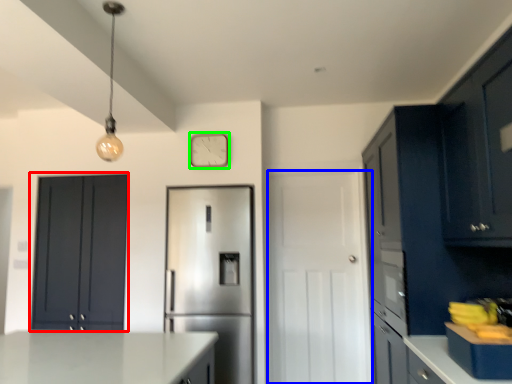
Question: Which object is the closest to the cabinetry (highlighted by a red box)? Choose among these: door (highlighted by a blue box) or clock (highlighted by a green box).

Choices:
 (A) door
 (B) clock

Answer: (B)